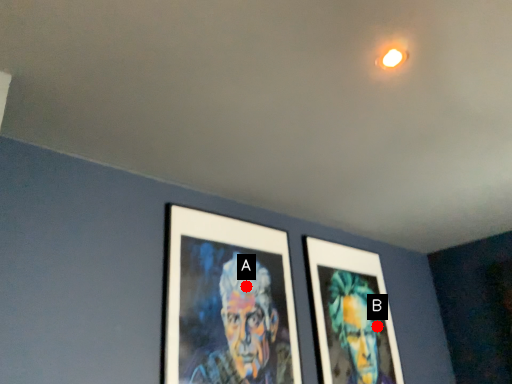
Question: Two points are circled on the image, labeled by A and B beside each circle. Among these points, which one is farthest from the camera?

Choices:
 (A) A is further
 (B) B is further

Answer: (B)